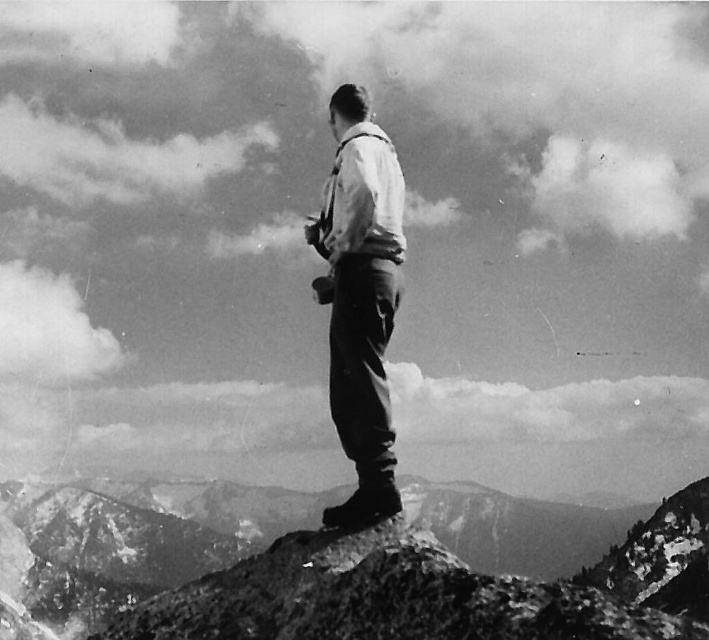
Question: Does rugged stone mountain at center have a larger size compared to matte white shirt at center?

Choices:
 (A) no
 (B) yes

Answer: (B)

Question: Can you confirm if rugged stone mountain at center is bigger than matte white shirt at center?

Choices:
 (A) yes
 (B) no

Answer: (A)

Question: Can you confirm if rugged stone mountain at center is positioned to the left of matte white shirt at center?

Choices:
 (A) yes
 (B) no

Answer: (B)

Question: Which of the following is the closest to the observer?

Choices:
 (A) (16, 532)
 (B) (374, 392)

Answer: (B)